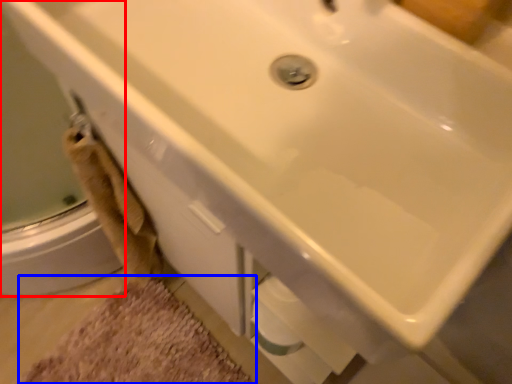
Question: Which object is closer to the camera taking this photo, shower door (highlighted by a red box) or bath mat (highlighted by a blue box)?

Choices:
 (A) shower door
 (B) bath mat

Answer: (A)